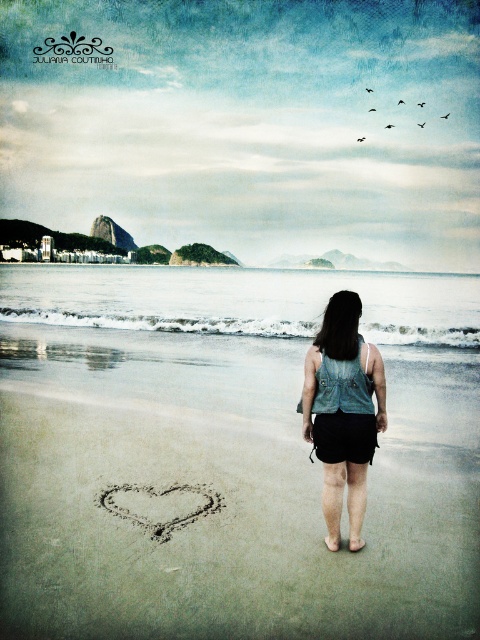
You are a photographer trying to capture the person in the denim vest at center and the brown sand heart at lower center in a single shot. Which object is positioned closer to the camera?

The denim vest at center is closer to the viewer than the brown sand heart at lower center, so it will appear closer to the camera in the photo.

You are a photographer trying to capture the person in the denim vest at center and the brown sand heart at lower center in a single frame. Which object will appear bigger in the photo?

The denim vest at center will appear bigger in the photo because it has a larger size compared to the brown sand heart at lower center.

You are a photographer trying to capture the smooth sand heart at center and the denim vest at center in the same frame. Based on their positions, which object should you adjust your camera to focus on first to ensure both are in the shot?

The smooth sand heart at center is to the left of denim vest at center, so you should focus on the denim vest at center first as it is positioned further to the right, ensuring both objects remain within the frame by centering on the rightmost object.